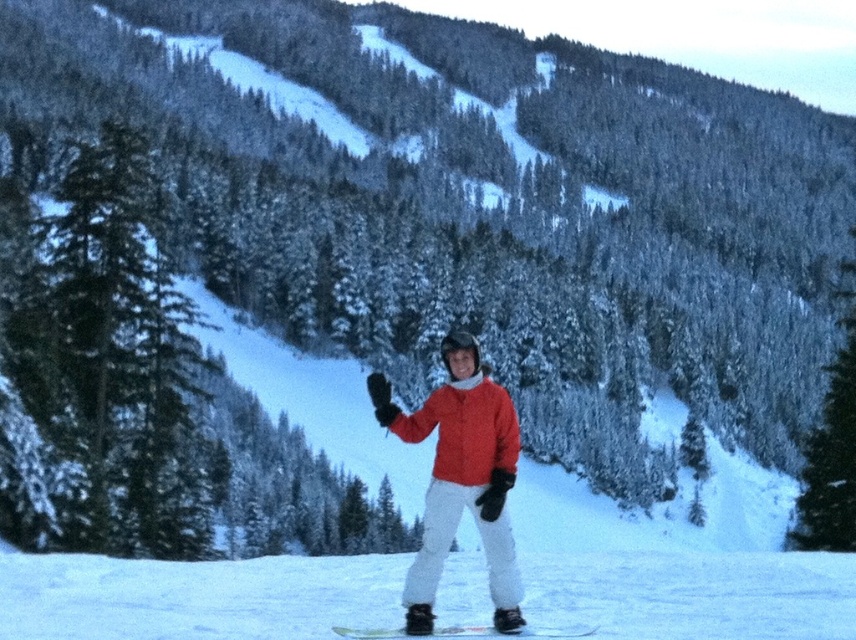
Consider the image. You are a photographer setting up a shot of the green textured pine tree at left and the green matte snowboard at center. You want to ensure both are in focus. Since the pine tree is above the snowboard, where should you position your camera focus point?

The green textured pine tree at left is located above the green matte snowboard at center. To have both in focus, position the focus point on the snowboard first, then adjust slightly upwards to include the tree in the depth of field.

Looking at this image, you are a photographer trying to capture a photo of the green textured pine tree at left and the matte red jacket at center. From your current position, which object is positioned to the left?

The green textured pine tree at left is positioned to the left of the matte red jacket at center.